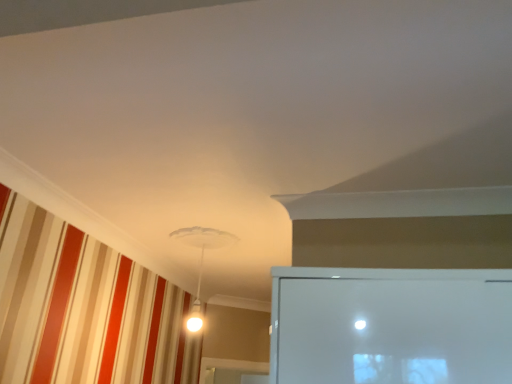
Describe the element at coordinates (201, 260) in the screenshot. I see `matte white light fixture at center` at that location.

Where is `matte white light fixture at center`? The image size is (512, 384). matte white light fixture at center is located at coordinates (201, 260).

Where is `matte white light fixture at center`? matte white light fixture at center is located at coordinates (201, 260).